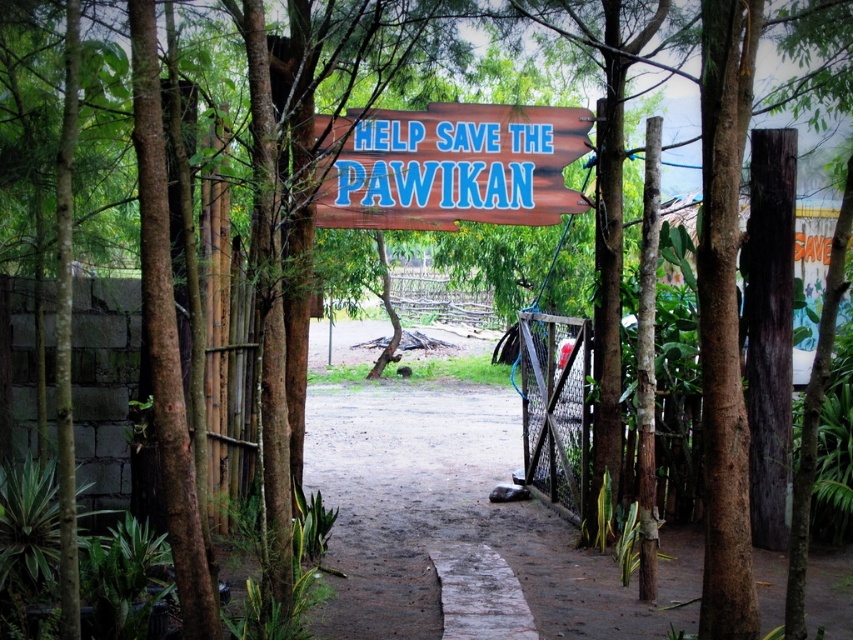
You are a visitor approaching the entrance of the sanctuary. You see the dull brown dirt at center and the wooden sign at center. Which object is positioned lower in the scene?

The dull brown dirt at center is located below the wooden sign at center, so it is positioned lower in the scene.

You are a visitor approaching the entrance of the sanctuary. You notice the dull brown dirt at center and the wooden sign at center. Which one is lower in height?

The dull brown dirt at center has a lesser height compared to the wooden sign at center, so the dull brown dirt at center is lower.

You are a delivery person with a cart that is 1.5 meters wide. You need to enter the conservation area through the entrance shown. Can your cart fit through the space between the dull brown dirt at center and the wire mesh gate at center?

The space between the dull brown dirt at center and the wire mesh gate at center is 1.64 meters. Since your cart is 1.5 meters wide, it can fit through the space as there is enough clearance.